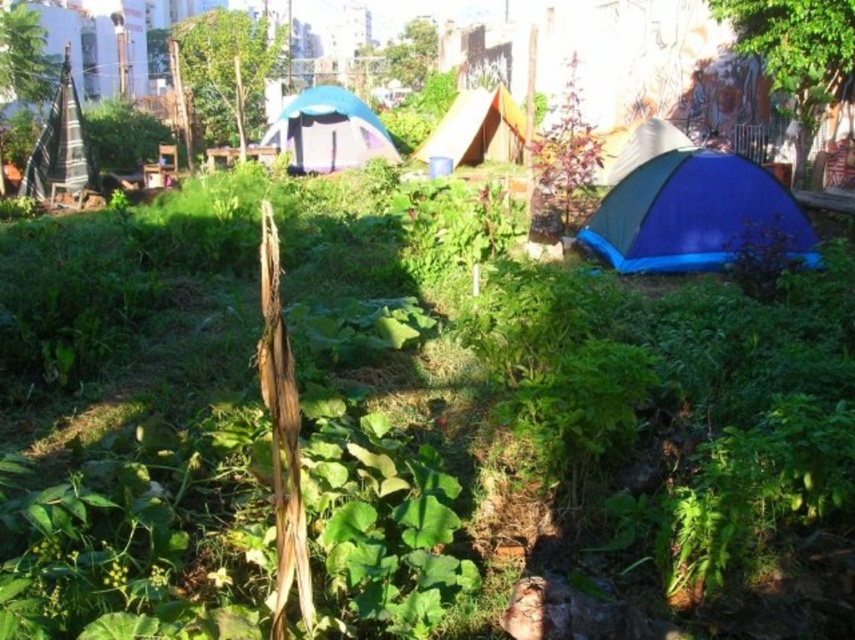
Question: Which object is positioned farthest from the blue fabric tent at center-right?

Choices:
 (A) white fabric tent at center
 (B) blue fabric tent at center
 (C) orange canvas tent at center

Answer: (B)

Question: Which object is positioned farthest from the blue fabric tent at center?

Choices:
 (A) orange canvas tent at center
 (B) blue fabric tent at center-right
 (C) white fabric tent at center

Answer: (B)

Question: Does orange canvas tent at center appear under white fabric tent at center?

Choices:
 (A) no
 (B) yes

Answer: (A)

Question: Which point appears farthest from the camera in this image?

Choices:
 (A) (615, 170)
 (B) (494, 145)

Answer: (B)

Question: Is blue fabric tent at center closer to camera compared to orange canvas tent at center?

Choices:
 (A) no
 (B) yes

Answer: (A)

Question: Is orange canvas tent at center closer to the viewer compared to white fabric tent at center?

Choices:
 (A) yes
 (B) no

Answer: (B)